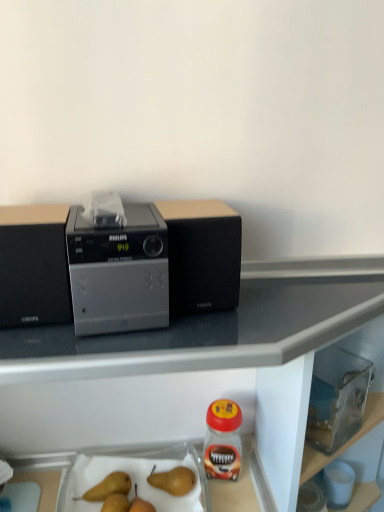
Question: Would you say transparent plastic container at lower right is part of satin silver radio at center's contents?

Choices:
 (A) no
 (B) yes

Answer: (A)

Question: Is satin silver radio at center next to transparent plastic container at lower right and touching it?

Choices:
 (A) yes
 (B) no

Answer: (B)

Question: Can you confirm if satin silver radio at center is positioned to the right of transparent plastic container at lower right?

Choices:
 (A) no
 (B) yes

Answer: (A)

Question: Could you tell me if satin silver radio at center is turned towards transparent plastic container at lower right?

Choices:
 (A) yes
 (B) no

Answer: (B)

Question: From the image's perspective, would you say satin silver radio at center is shown under transparent plastic container at lower right?

Choices:
 (A) no
 (B) yes

Answer: (A)

Question: Does point (213, 433) appear closer or farther from the camera than point (147, 365)?

Choices:
 (A) closer
 (B) farther

Answer: (B)

Question: Visually, is clear glass jar at lower right positioned to the left or to the right of black glossy table at upper center?

Choices:
 (A) left
 (B) right

Answer: (B)

Question: Is clear glass jar at lower right in front of or behind black glossy table at upper center in the image?

Choices:
 (A) front
 (B) behind

Answer: (B)

Question: From the image's perspective, is clear glass jar at lower right located above or below black glossy table at upper center?

Choices:
 (A) below
 (B) above

Answer: (B)

Question: Is smooth brown pear at lower left, the first fruit from the left, taller or shorter than clear glass jar at lower right?

Choices:
 (A) tall
 (B) short

Answer: (B)

Question: Is point (105, 477) closer or farther from the camera than point (206, 451)?

Choices:
 (A) farther
 (B) closer

Answer: (B)

Question: From the image's perspective, is smooth brown pear at lower left, the first fruit from the left, above or below clear glass jar at lower right?

Choices:
 (A) below
 (B) above

Answer: (A)

Question: Based on their sizes in the image, would you say smooth brown pear at lower left, acting as the third fruit starting from the right, is bigger or smaller than clear glass jar at lower right?

Choices:
 (A) big
 (B) small

Answer: (B)

Question: In terms of size, does smooth brown pears at lower center, the 2th fruit when ordered from left to right, appear bigger or smaller than black glossy table at upper center?

Choices:
 (A) big
 (B) small

Answer: (B)

Question: Is smooth brown pears at lower center, the 2th fruit when ordered from left to right, spatially inside black glossy table at upper center, or outside of it?

Choices:
 (A) inside
 (B) outside

Answer: (A)